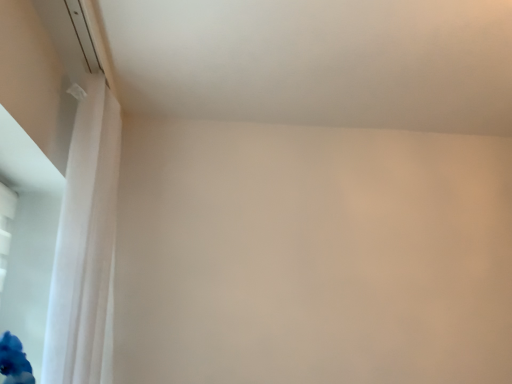
Question: Does transparent plastic window screen at lower left have a lesser width compared to white sheer curtain at left?

Choices:
 (A) yes
 (B) no

Answer: (A)

Question: Does transparent plastic window screen at lower left appear on the right side of white sheer curtain at left?

Choices:
 (A) no
 (B) yes

Answer: (A)

Question: Is transparent plastic window screen at lower left surrounding white sheer curtain at left?

Choices:
 (A) no
 (B) yes

Answer: (A)

Question: From the image's perspective, is transparent plastic window screen at lower left over white sheer curtain at left?

Choices:
 (A) no
 (B) yes

Answer: (A)

Question: Can you confirm if transparent plastic window screen at lower left is wider than white sheer curtain at left?

Choices:
 (A) yes
 (B) no

Answer: (B)

Question: Could you tell me if transparent plastic window screen at lower left is turned towards white sheer curtain at left?

Choices:
 (A) no
 (B) yes

Answer: (A)

Question: Is white sheer curtain at left bigger than transparent plastic window screen at lower left?

Choices:
 (A) yes
 (B) no

Answer: (A)

Question: Considering the relative sizes of white sheer curtain at left and transparent plastic window screen at lower left in the image provided, is white sheer curtain at left thinner than transparent plastic window screen at lower left?

Choices:
 (A) no
 (B) yes

Answer: (A)

Question: Is white sheer curtain at left turned away from transparent plastic window screen at lower left?

Choices:
 (A) no
 (B) yes

Answer: (B)

Question: From the image's perspective, does white sheer curtain at left appear higher than transparent plastic window screen at lower left?

Choices:
 (A) yes
 (B) no

Answer: (A)

Question: Does white sheer curtain at left have a smaller size compared to transparent plastic window screen at lower left?

Choices:
 (A) no
 (B) yes

Answer: (A)

Question: Would you consider white sheer curtain at left to be distant from transparent plastic window screen at lower left?

Choices:
 (A) yes
 (B) no

Answer: (B)

Question: Based on their positions, is white sheer curtain at left located to the left or right of transparent plastic window screen at lower left?

Choices:
 (A) left
 (B) right

Answer: (B)